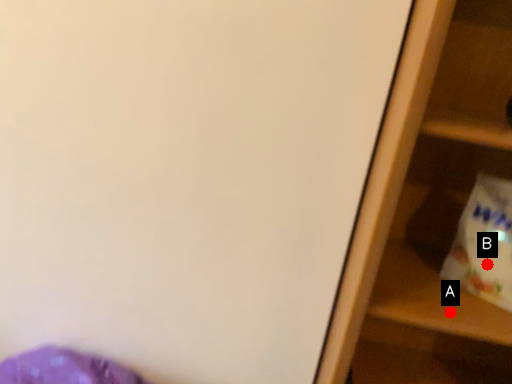
Question: Two points are circled on the image, labeled by A and B beside each circle. Which point is farther to the camera?

Choices:
 (A) A is further
 (B) B is further

Answer: (B)